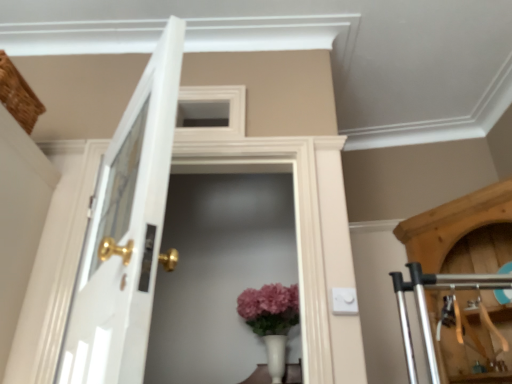
This screenshot has height=384, width=512. What do you see at coordinates (126, 232) in the screenshot? I see `white glossy door at left` at bounding box center [126, 232].

At what (x,y) coordinates should I click in order to perform the action: click on white glossy door at left. Please return your answer as a coordinate pair (x, y). Looking at the image, I should click on (126, 232).

This screenshot has width=512, height=384. Find the location of `matte white vase at center`. matte white vase at center is located at coordinates (271, 320).

Is matte white vase at center inside or outside of white glossy door at left?

matte white vase at center is outside white glossy door at left.

From a real-world perspective, which is physically below, matte white vase at center or white glossy door at left?

From a 3D spatial view, matte white vase at center is below.

Which is further, (261, 327) or (133, 208)?

The point (261, 327) is farther.

Could you tell me if matte white vase at center is turned towards white glossy door at left?

Yes, matte white vase at center is aimed at white glossy door at left.

Is matte white vase at center completely or partially inside white glass screen door at center?

No.

Is point (209, 256) closer or farther from the camera than point (274, 362)?

Point (209, 256) is farther from the camera than point (274, 362).

Are white glass screen door at center and matte white vase at center beside each other?

No, white glass screen door at center is not touching matte white vase at center.

From a real-world perspective, is white glass screen door at center physically below matte white vase at center?

No, from a real-world perspective, white glass screen door at center is not beneath matte white vase at center.

Considering the positions of objects white glossy door at left and matte white vase at center in the image provided, who is more to the left, white glossy door at left or matte white vase at center?

white glossy door at left is more to the left.

Between point (152, 82) and point (298, 312), which one is positioned in front?

Point (152, 82)

Which object is closer to the camera, white glossy door at left or matte white vase at center?

Positioned in front is white glossy door at left.

Can you confirm if white glossy door at left is shorter than matte white vase at center?

In fact, white glossy door at left may be taller than matte white vase at center.

Looking at the image, does white glossy door at left seem bigger or smaller compared to white glass screen door at center?

Clearly, white glossy door at left is larger in size than white glass screen door at center.

Is white glossy door at left not inside white glass screen door at center?

white glossy door at left lies outside white glass screen door at center's area.

From the image's perspective, which is above, white glossy door at left or white glass screen door at center?

white glossy door at left appears higher in the image.

Identify the location of door below the white glass screen door at center (from a real-world perspective). tap(126, 232).

Choose the correct answer: Is matte white vase at center inside white glass screen door at center or outside it?

The correct answer is: outside.

Would you say matte white vase at center is to the left or to the right of white glass screen door at center in the picture?

matte white vase at center is to the right of white glass screen door at center.

Is matte white vase at center taller than white glass screen door at center?

In fact, matte white vase at center may be shorter than white glass screen door at center.

Image resolution: width=512 pixels, height=384 pixels. I want to click on screen door that is above the matte white vase at center (from a real-world perspective), so click(x=218, y=273).

Is white glass screen door at center wider than white glossy door at left?

No, white glass screen door at center is not wider than white glossy door at left.

Would you say white glass screen door at center is inside or outside white glossy door at left?

white glass screen door at center is not enclosed by white glossy door at left.

From a real-world perspective, is white glass screen door at center located beneath white glossy door at left?

No, from a real-world perspective, white glass screen door at center is not under white glossy door at left.

Is white glass screen door at center at the left side of white glossy door at left?

Incorrect, white glass screen door at center is not on the left side of white glossy door at left.

Find the location of a particular element. The width and height of the screenshot is (512, 384). door that appears above the matte white vase at center (from a real-world perspective) is located at coordinates (126, 232).

Find the location of a particular element. The width and height of the screenshot is (512, 384). floral arrangement lying below the white glass screen door at center (from the image's perspective) is located at coordinates (271, 320).

Looking at the image, which one is located further to white glossy door at left, white glass screen door at center or matte white vase at center?

Among the two, white glass screen door at center is located further to white glossy door at left.

When comparing their distances from matte white vase at center, does white glass screen door at center or white glossy door at left seem closer?

Based on the image, white glass screen door at center appears to be nearer to matte white vase at center.

Which object lies further to the anchor point matte white vase at center, white glossy door at left or white glass screen door at center?

The object further to matte white vase at center is white glossy door at left.

Based on their spatial positions, is matte white vase at center or white glossy door at left further from white glass screen door at center?

The object further to white glass screen door at center is white glossy door at left.

Which object lies nearer to the anchor point white glossy door at left, matte white vase at center or white glass screen door at center?

matte white vase at center is closer to white glossy door at left.

Looking at the image, which one is located closer to white glass screen door at center, white glossy door at left or matte white vase at center?

The object closer to white glass screen door at center is matte white vase at center.

Where is `screen door positioned between white glossy door at left and matte white vase at center from near to far`? screen door positioned between white glossy door at left and matte white vase at center from near to far is located at coordinates (218, 273).